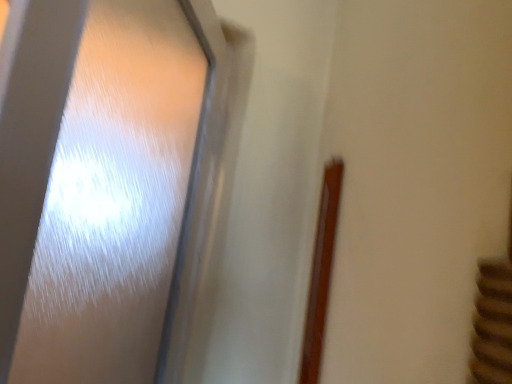
Where is `transparent glass window at upper left`? transparent glass window at upper left is located at coordinates (105, 184).

What do you see at coordinates (105, 184) in the screenshot?
I see `transparent glass window at upper left` at bounding box center [105, 184].

Image resolution: width=512 pixels, height=384 pixels. In order to click on transparent glass window at upper left in this screenshot , I will do `click(105, 184)`.